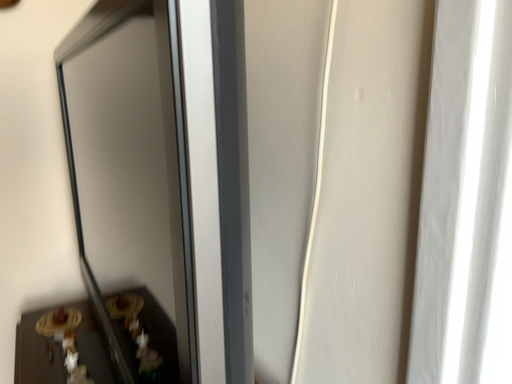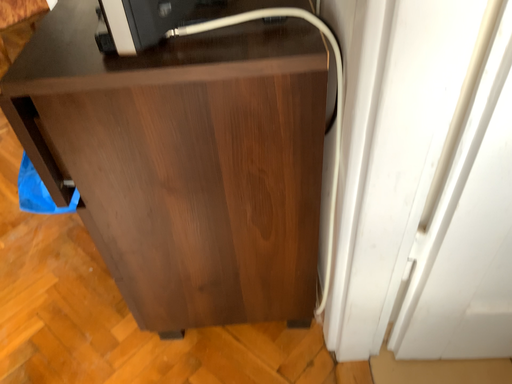
Question: How did the camera likely rotate when shooting the video?

Choices:
 (A) rotated left
 (B) rotated right

Answer: (A)